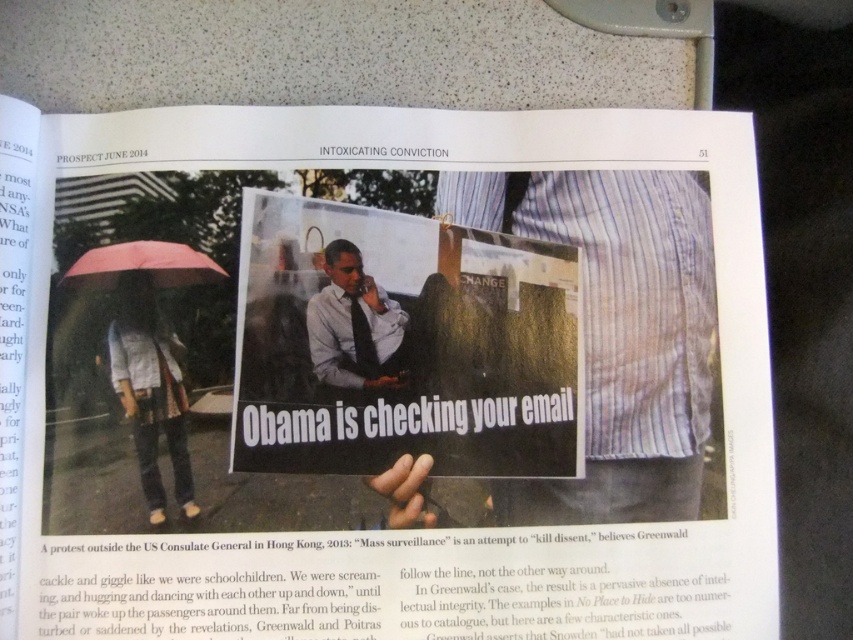
Question: Can you confirm if light blue shirt at center is positioned to the right of pink matte umbrella at upper left?

Choices:
 (A) no
 (B) yes

Answer: (B)

Question: Which object is positioned closest to the light blue shirt at center?

Choices:
 (A) pink matte umbrella at upper left
 (B) white paper poster at center

Answer: (B)

Question: Is white paper poster at center positioned before denim jacket at lower left?

Choices:
 (A) yes
 (B) no

Answer: (B)

Question: Which of these objects is positioned farthest from the white paper poster at center?

Choices:
 (A) pink matte umbrella at upper left
 (B) light blue shirt at center
 (C) denim jacket at lower left

Answer: (A)

Question: Based on their relative distances, which object is nearer to the pink matte umbrella at upper left?

Choices:
 (A) denim jacket at lower left
 (B) white paper poster at center
 (C) light blue shirt at center

Answer: (A)

Question: Is denim jacket at lower left below light blue shirt at center?

Choices:
 (A) yes
 (B) no

Answer: (A)